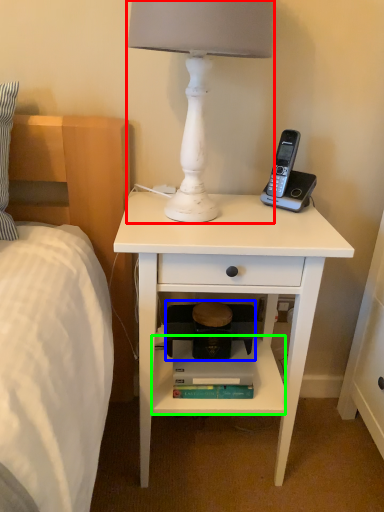
Question: Which object is positioned closest to lamp (highlighted by a red box)? Select from step stool (highlighted by a blue box) and shelf (highlighted by a green box).

Choices:
 (A) step stool
 (B) shelf

Answer: (A)